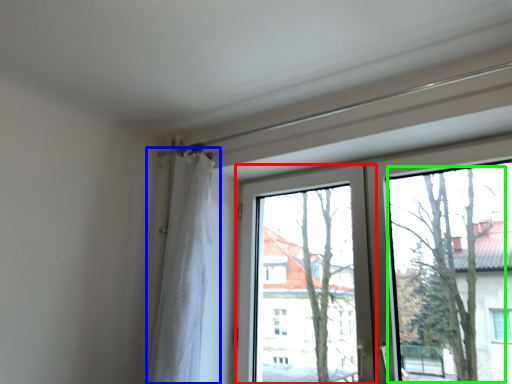
Question: Estimate the real-world distances between objects in this image. Which object is farther from window screen (highlighted by a red box), curtain (highlighted by a blue box) or tree (highlighted by a green box)?

Choices:
 (A) curtain
 (B) tree

Answer: (A)